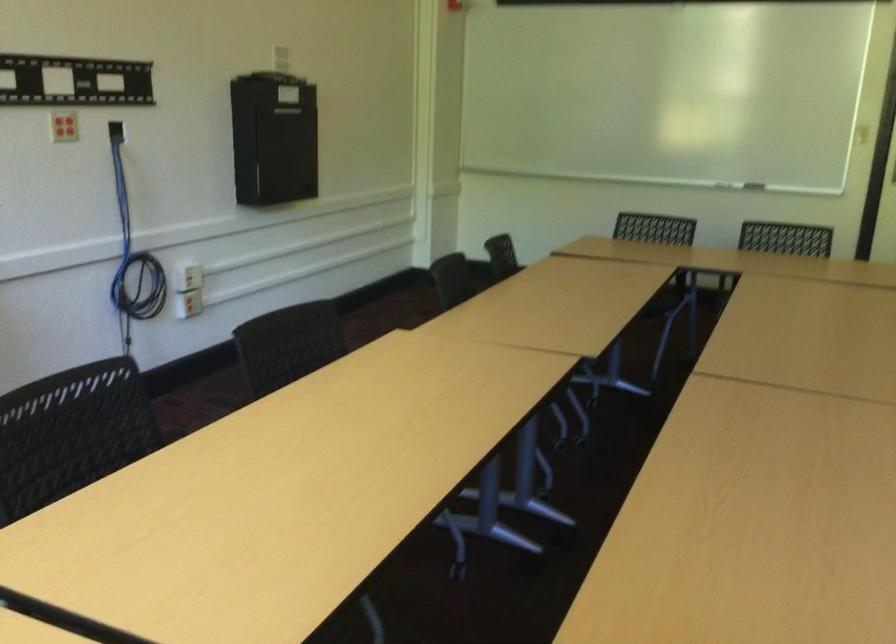
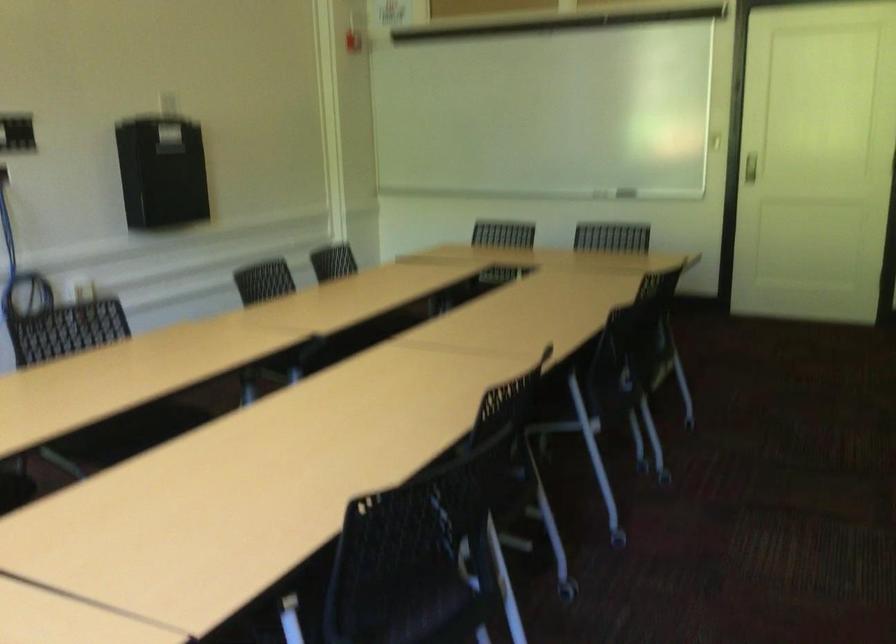
What movement of the cameraman would produce the second image?

The cameraman walked toward right, backward.